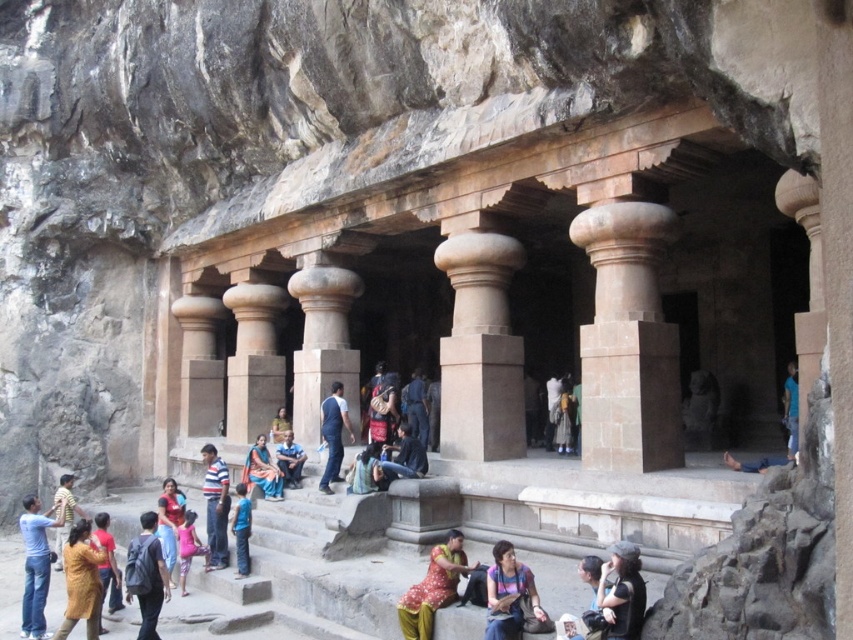
You are standing at the entrance of the historical structure and want to find the yellow cotton dress at lower left. Which direction should you look to locate it?

The yellow cotton dress at lower left is located at the lower left direction from your current position at the entrance.

You are a tourist standing at the entrance of the historical structure. You want to take a photo of the sandy brown stone column at center and the dark brown leather jacket at lower center together in the frame. Which object should you move closer to first to ensure both are in focus?

You should move closer to the sandy brown stone column at center first because it is further away from you than the dark brown leather jacket at lower center, so adjusting your position to focus on it will help both objects appear in focus.